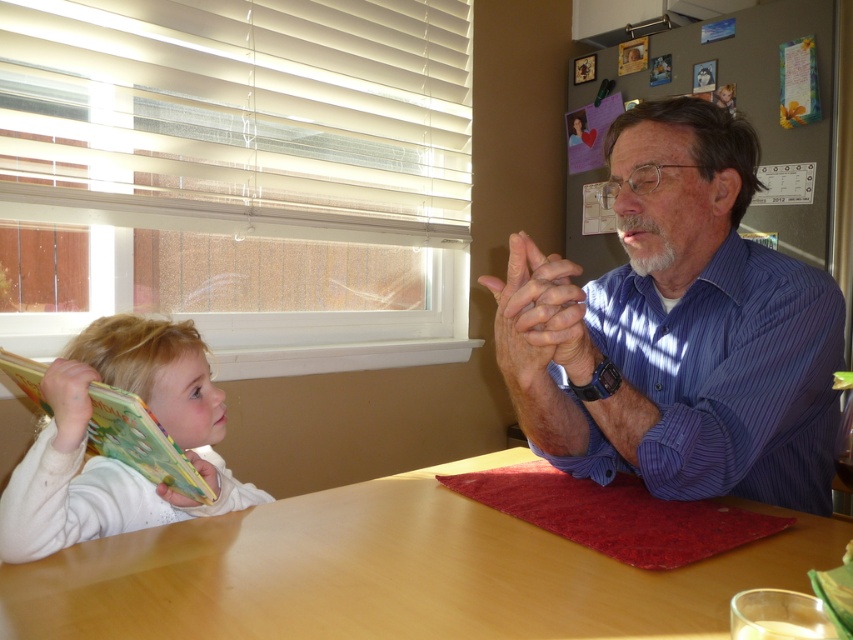
Can you confirm if blue striped shirt at center is wider than wooden table at center?

In fact, blue striped shirt at center might be narrower than wooden table at center.

Which is more to the left, blue striped shirt at center or wooden table at center?

wooden table at center

Is point (601, 349) closer to viewer compared to point (442, 497)?

No, (601, 349) is behind (442, 497).

Identify the location of blue striped shirt at center. (677, 330).

Is blue striped shirt at center taller than white cloth book at left?

Yes, blue striped shirt at center is taller than white cloth book at left.

Who is more distant from viewer, (683, 224) or (65, 376)?

Point (683, 224)

Is point (614, 353) behind point (56, 499)?

Yes.

Identify the location of blue striped shirt at center. Image resolution: width=853 pixels, height=640 pixels. (677, 330).

Can you confirm if white plastic blinds at upper left is positioned to the right of white cloth book at left?

Indeed, white plastic blinds at upper left is positioned on the right side of white cloth book at left.

Between white plastic blinds at upper left and white cloth book at left, which one appears on the left side from the viewer's perspective?

white cloth book at left

What do you see at coordinates (242, 102) in the screenshot?
I see `white plastic blinds at upper left` at bounding box center [242, 102].

The width and height of the screenshot is (853, 640). I want to click on white plastic blinds at upper left, so click(x=242, y=102).